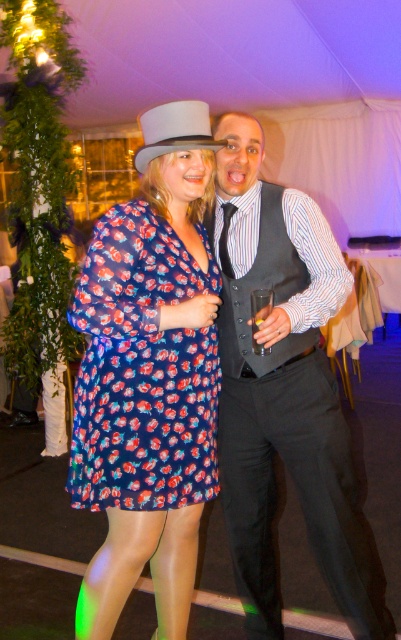
Is point (342, 284) in front of point (196, 104)?

No.

Which of these two, matte black vest at center or gray felt fedora at upper center, stands shorter?

gray felt fedora at upper center

Does point (247, 528) come behind point (170, 120)?

Yes, point (247, 528) is behind point (170, 120).

This screenshot has height=640, width=401. In order to click on matte black vest at center in this screenshot , I will do `click(285, 394)`.

Can you confirm if floral print fabric dress at center is shorter than gray felt fedora at upper center?

Incorrect, floral print fabric dress at center's height does not fall short of gray felt fedora at upper center's.

Which is below, floral print fabric dress at center or gray felt fedora at upper center?

floral print fabric dress at center is lower down.

Is point (99, 472) in front of point (149, 125)?

No, it is not.

Locate an element on the screen. floral print fabric dress at center is located at coordinates (143, 371).

The image size is (401, 640). What do you see at coordinates (285, 394) in the screenshot? I see `matte black vest at center` at bounding box center [285, 394].

Can you confirm if matte black vest at center is positioned to the left of floral print fabric dress at center?

In fact, matte black vest at center is to the right of floral print fabric dress at center.

Is point (330, 515) positioned behind point (129, 371)?

Yes, point (330, 515) is farther from viewer.

Image resolution: width=401 pixels, height=640 pixels. Identify the location of matte black vest at center. (285, 394).